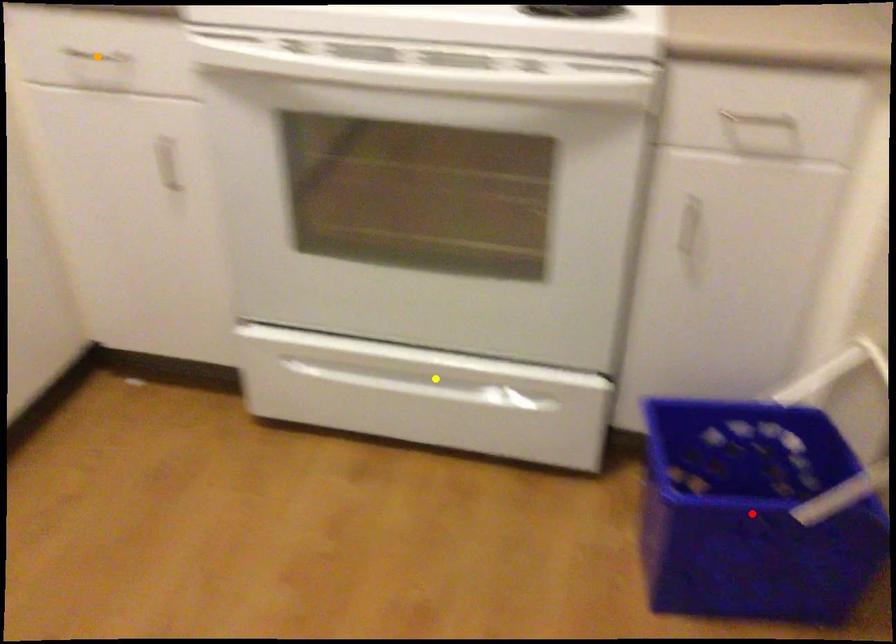
Order these from nearest to farthest:
1. orange point
2. red point
3. yellow point

red point → orange point → yellow point